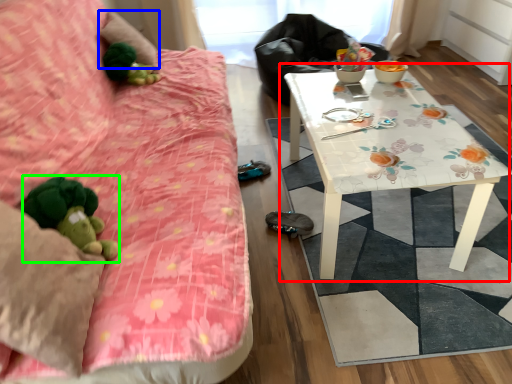
Question: Considering the real-world distances, which object is farthest from table (highlighted by a red box)? pillow (highlighted by a blue box) or toy (highlighted by a green box)?

Choices:
 (A) pillow
 (B) toy

Answer: (A)